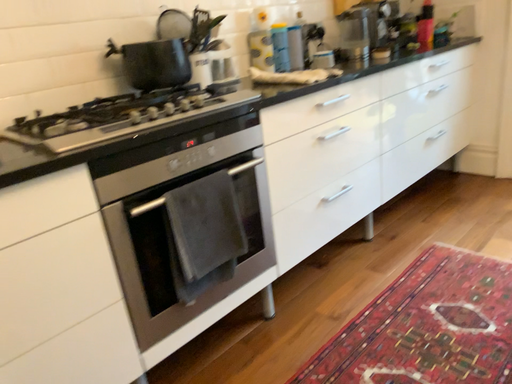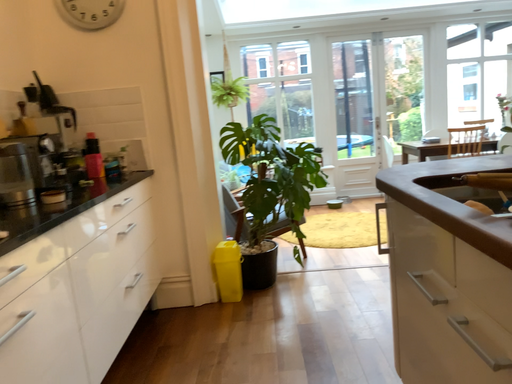
Question: Which way did the camera rotate in the video?

Choices:
 (A) rotated upward
 (B) rotated downward

Answer: (A)